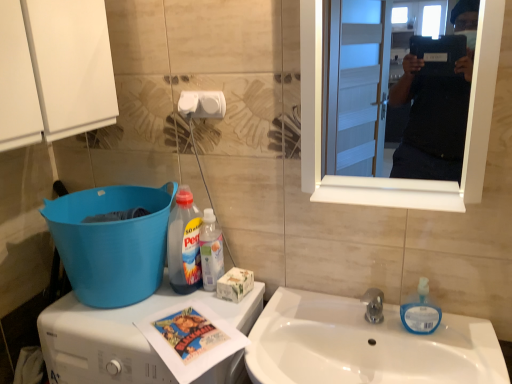
Identify the location of blank space above printed paper magazine at lower left (from a real-world perspective). (177, 329).